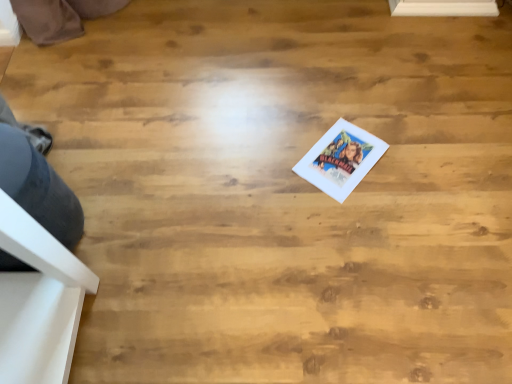
You are a GUI agent. You are given a task and a screenshot of the screen. Output one action in this format:
    pyautogui.click(x=<x>, y=<y>)
    Task: Click on the spots to the right of gray fabric shoe at lower left
    This screenshot has width=512, height=384.
    Given the screenshot: What is the action you would take?
    pyautogui.click(x=133, y=226)